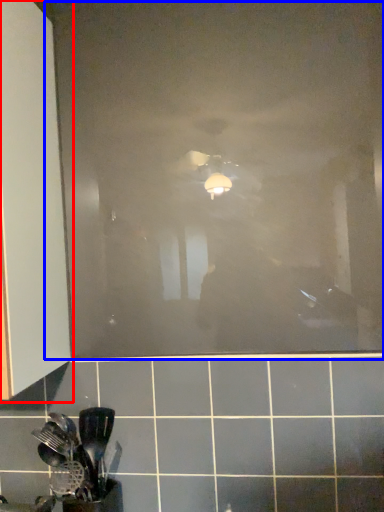
Question: Which object is further to the camera taking this photo, cabinetry (highlighted by a red box) or glass door (highlighted by a blue box)?

Choices:
 (A) cabinetry
 (B) glass door

Answer: (B)